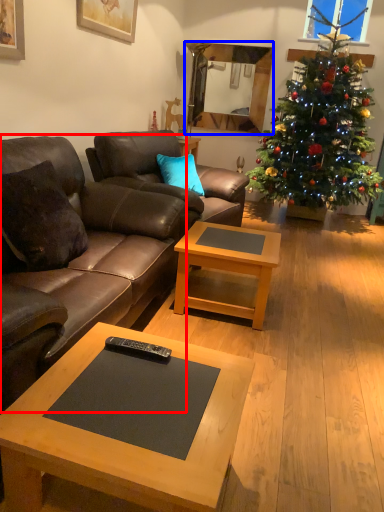
Question: Among these objects, which one is nearest to the camera, studio couch (highlighted by a red box) or mirror (highlighted by a blue box)?

Choices:
 (A) studio couch
 (B) mirror

Answer: (A)